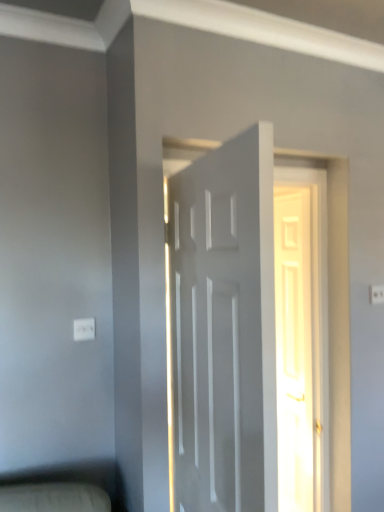
Question: From the image's perspective, is white glossy door at center, placed as the first door when sorted from back to front, located above or below white plastic electric outlet at upper right, arranged as the 2th electric outlet when viewed from the left?

Choices:
 (A) above
 (B) below

Answer: (B)

Question: Is white glossy door at center, which ranks as the second door in left-to-right order, bigger or smaller than white plastic electric outlet at upper right, which is the 2th electric outlet from front to back?

Choices:
 (A) big
 (B) small

Answer: (A)

Question: Considering the real-world distances, which object is closest to the white plastic electric outlet at upper right, the first electric outlet viewed from the back?

Choices:
 (A) white plastic electric outlet at lower left, which is the second electric outlet in back-to-front order
 (B) white matte door at center, marked as the first door in a front-to-back arrangement
 (C) white glossy door at center, the first door viewed from the right

Answer: (C)

Question: Estimate the real-world distances between objects in this image. Which object is farther from the white plastic electric outlet at lower left, which is the second electric outlet in back-to-front order?

Choices:
 (A) white matte door at center, which is the first door from left to right
 (B) white plastic electric outlet at upper right, arranged as the 2th electric outlet when viewed from the left
 (C) white glossy door at center, the second door when ordered from front to back

Answer: (C)